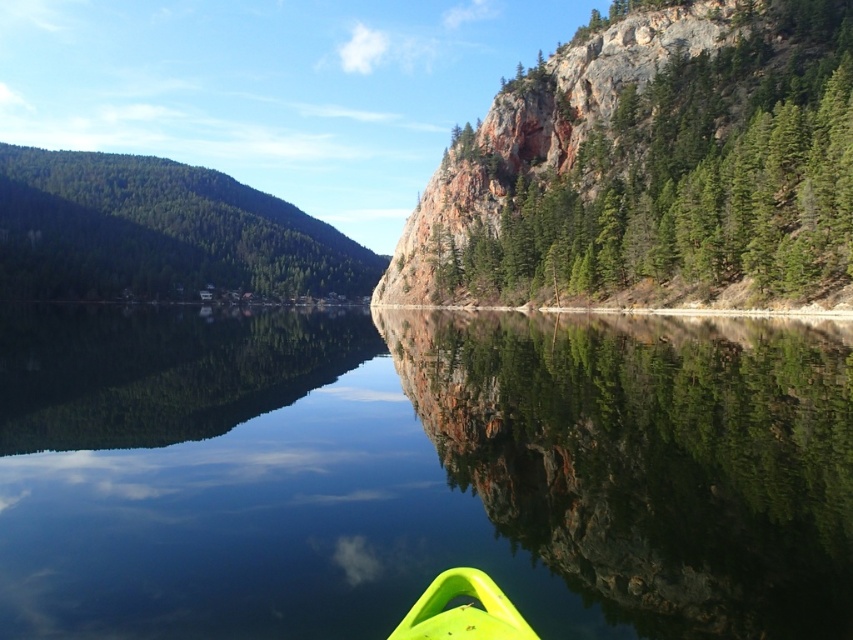
You are an adventurer standing at the edge of the lake, looking towards the steep cliff. You see the neon yellow plastic kayak at lower center and the green textured rock at upper right. Which object is closer to you, the observer?

The green textured rock at upper right is closer to you because the neon yellow plastic kayak at lower center is positioned behind it.

You are standing at the edge of the lake and see the point marked as point (x=419, y=472). Based on the scene description, what is the most likely feature at that point?

The point (x=419, y=472) marks transparent water at center.